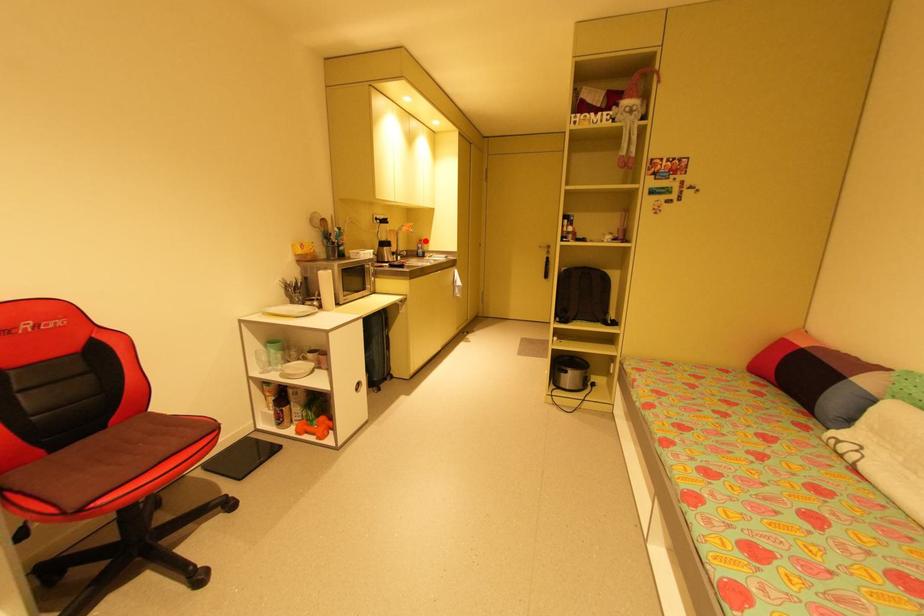
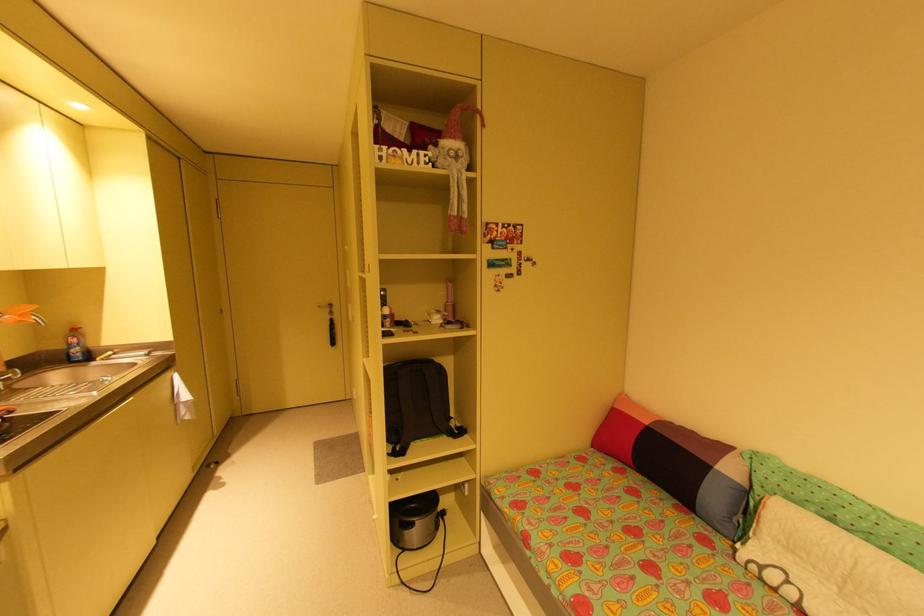
In the second image, find the point that corresponds to the highlighted location in the first image.

(79, 331)